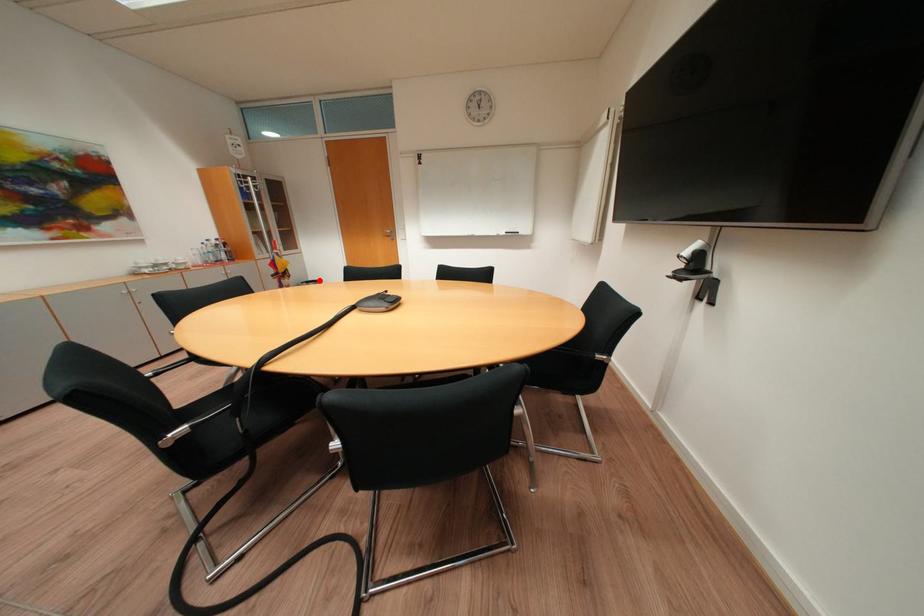
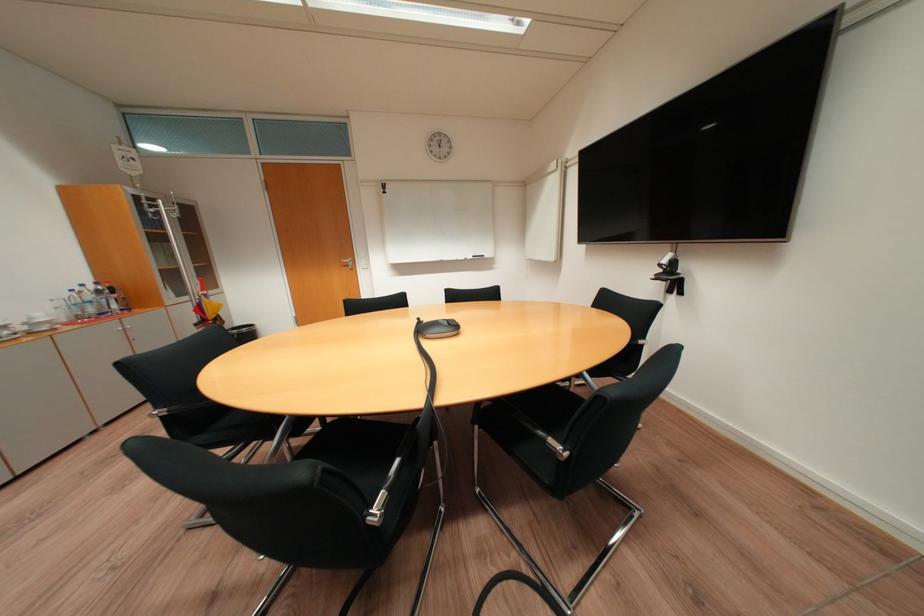
Question: I am providing you with two images of the same scene from different viewpoints. Given a red point in image1, look at the same physical point in image2. Is it:

Choices:
 (A) Closer to the viewpoint
 (B) Farther from the viewpoint

Answer: (A)